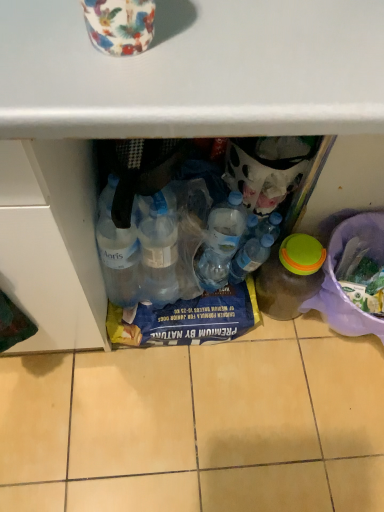
This screenshot has width=384, height=512. Find the location of `transparent plastic bottle at center, the 1th bottle in the left-to-right sequence`. transparent plastic bottle at center, the 1th bottle in the left-to-right sequence is located at coordinates (250, 257).

The width and height of the screenshot is (384, 512). What do you see at coordinates (250, 257) in the screenshot?
I see `transparent plastic bottle at center, the 1th bottle in the left-to-right sequence` at bounding box center [250, 257].

Image resolution: width=384 pixels, height=512 pixels. Describe the element at coordinates (290, 276) in the screenshot. I see `transparent plastic bottle at lower right, marked as the second bottle in a left-to-right arrangement` at that location.

This screenshot has width=384, height=512. I want to click on transparent plastic bottle at lower right, which is the first bottle in right-to-left order, so click(290, 276).

This screenshot has height=512, width=384. What are the coordinates of `transparent plastic bottle at center, the 1th bottle in the left-to-right sequence` in the screenshot? It's located at (250, 257).

Is transparent plastic bottle at lower right, marked as the second bottle in a left-to-right arrangement, to the left of transparent plastic bottle at center, positioned as the second bottle in right-to-left order, from the viewer's perspective?

No, transparent plastic bottle at lower right, marked as the second bottle in a left-to-right arrangement, is not to the left of transparent plastic bottle at center, positioned as the second bottle in right-to-left order.

Which object is further away from the camera taking this photo, transparent plastic bottle at lower right, marked as the second bottle in a left-to-right arrangement, or transparent plastic bottle at center, the 1th bottle in the left-to-right sequence?

transparent plastic bottle at center, the 1th bottle in the left-to-right sequence, is further away from the camera.

Is point (287, 250) positioned in front of point (246, 251)?

That is True.

From the image's perspective, which is above, transparent plastic bottle at lower right, marked as the second bottle in a left-to-right arrangement, or transparent plastic bottle at center, the 1th bottle in the left-to-right sequence?

From the image's view, transparent plastic bottle at center, the 1th bottle in the left-to-right sequence, is above.

From a real-world perspective, is transparent plastic bottle at lower right, marked as the second bottle in a left-to-right arrangement, positioned over transparent plastic bottle at center, the 1th bottle in the left-to-right sequence, based on gravity?

Actually, transparent plastic bottle at lower right, marked as the second bottle in a left-to-right arrangement, is physically below transparent plastic bottle at center, the 1th bottle in the left-to-right sequence, in the real world.

Considering the relative sizes of transparent plastic bottle at lower right, which is the first bottle in right-to-left order, and transparent plastic bottle at center, positioned as the second bottle in right-to-left order, in the image provided, is transparent plastic bottle at lower right, which is the first bottle in right-to-left order, wider than transparent plastic bottle at center, positioned as the second bottle in right-to-left order,?

Correct, the width of transparent plastic bottle at lower right, which is the first bottle in right-to-left order, exceeds that of transparent plastic bottle at center, positioned as the second bottle in right-to-left order.

Who is shorter, transparent plastic bottle at lower right, which is the first bottle in right-to-left order, or transparent plastic bottle at center, the 1th bottle in the left-to-right sequence?

transparent plastic bottle at center, the 1th bottle in the left-to-right sequence.

Looking at the image, does transparent plastic bottle at lower right, marked as the second bottle in a left-to-right arrangement, seem bigger or smaller compared to transparent plastic bottle at center, the 1th bottle in the left-to-right sequence?

In the image, transparent plastic bottle at lower right, marked as the second bottle in a left-to-right arrangement, appears to be larger than transparent plastic bottle at center, the 1th bottle in the left-to-right sequence.

Is transparent plastic bottle at lower right, marked as the second bottle in a left-to-right arrangement, positioned beyond the bounds of transparent plastic bottle at center, the 1th bottle in the left-to-right sequence?

Yes, transparent plastic bottle at lower right, marked as the second bottle in a left-to-right arrangement, is outside of transparent plastic bottle at center, the 1th bottle in the left-to-right sequence.

Is transparent plastic bottle at lower right, marked as the second bottle in a left-to-right arrangement, beside transparent plastic bottle at center, the 1th bottle in the left-to-right sequence?

Yes.

Could you tell me if transparent plastic bottle at lower right, which is the first bottle in right-to-left order, is turned towards transparent plastic bottle at center, positioned as the second bottle in right-to-left order?

No, transparent plastic bottle at lower right, which is the first bottle in right-to-left order, is not aimed at transparent plastic bottle at center, positioned as the second bottle in right-to-left order.

How many degrees apart are the facing directions of transparent plastic bottle at lower right, which is the first bottle in right-to-left order, and transparent plastic bottle at center, the 1th bottle in the left-to-right sequence?

The angular difference between transparent plastic bottle at lower right, which is the first bottle in right-to-left order, and transparent plastic bottle at center, the 1th bottle in the left-to-right sequence, is 1.74 degrees.

I want to click on bottle above the transparent plastic bottle at lower right, which is the first bottle in right-to-left order (from the image's perspective), so click(x=250, y=257).

Based on their positions, is transparent plastic bottle at center, positioned as the second bottle in right-to-left order, located to the left or right of transparent plastic bottle at lower right, marked as the second bottle in a left-to-right arrangement?

Based on their positions, transparent plastic bottle at center, positioned as the second bottle in right-to-left order, is located to the left of transparent plastic bottle at lower right, marked as the second bottle in a left-to-right arrangement.

Considering their positions, is transparent plastic bottle at center, the 1th bottle in the left-to-right sequence, located in front of or behind transparent plastic bottle at lower right, which is the first bottle in right-to-left order?

In the image, transparent plastic bottle at center, the 1th bottle in the left-to-right sequence, appears behind transparent plastic bottle at lower right, which is the first bottle in right-to-left order.

Considering the points (252, 242) and (316, 285), which point is behind, point (252, 242) or point (316, 285)?

The point (316, 285) is farther.

From the image's perspective, is transparent plastic bottle at center, the 1th bottle in the left-to-right sequence, under transparent plastic bottle at lower right, which is the first bottle in right-to-left order?

Incorrect, from the image's perspective, transparent plastic bottle at center, the 1th bottle in the left-to-right sequence, is higher than transparent plastic bottle at lower right, which is the first bottle in right-to-left order.

In the scene shown: From a real-world perspective, who is located lower, transparent plastic bottle at center, positioned as the second bottle in right-to-left order, or transparent plastic bottle at lower right, which is the first bottle in right-to-left order?

transparent plastic bottle at lower right, which is the first bottle in right-to-left order, from a real-world perspective.

Does transparent plastic bottle at center, the 1th bottle in the left-to-right sequence, have a greater width compared to transparent plastic bottle at lower right, which is the first bottle in right-to-left order?

No.

Based on the photo, from their relative heights in the image, would you say transparent plastic bottle at center, positioned as the second bottle in right-to-left order, is taller or shorter than transparent plastic bottle at lower right, which is the first bottle in right-to-left order?

transparent plastic bottle at center, positioned as the second bottle in right-to-left order, is shorter than transparent plastic bottle at lower right, which is the first bottle in right-to-left order.

Who is smaller, transparent plastic bottle at center, positioned as the second bottle in right-to-left order, or transparent plastic bottle at lower right, marked as the second bottle in a left-to-right arrangement?

transparent plastic bottle at center, positioned as the second bottle in right-to-left order, is smaller.

Is transparent plastic bottle at center, the 1th bottle in the left-to-right sequence, located outside transparent plastic bottle at lower right, which is the first bottle in right-to-left order?

Yes.

From the picture: Is transparent plastic bottle at center, the 1th bottle in the left-to-right sequence, placed right next to transparent plastic bottle at lower right, marked as the second bottle in a left-to-right arrangement?

Yes, transparent plastic bottle at center, the 1th bottle in the left-to-right sequence, is touching transparent plastic bottle at lower right, marked as the second bottle in a left-to-right arrangement.

Does transparent plastic bottle at center, the 1th bottle in the left-to-right sequence, turn towards transparent plastic bottle at lower right, marked as the second bottle in a left-to-right arrangement?

No, transparent plastic bottle at center, the 1th bottle in the left-to-right sequence, is not turned towards transparent plastic bottle at lower right, marked as the second bottle in a left-to-right arrangement.

How distant is transparent plastic bottle at center, the 1th bottle in the left-to-right sequence, from transparent plastic bottle at lower right, which is the first bottle in right-to-left order?

A distance of 3.18 inches exists between transparent plastic bottle at center, the 1th bottle in the left-to-right sequence, and transparent plastic bottle at lower right, which is the first bottle in right-to-left order.

At what (x,y) coordinates should I click in order to perform the action: click on bottle that is on the right side of transparent plastic bottle at center, the 1th bottle in the left-to-right sequence. Please return your answer as a coordinate pair (x, y). The image size is (384, 512). Looking at the image, I should click on (290, 276).

At what (x,y) coordinates should I click in order to perform the action: click on bottle that is under the transparent plastic bottle at center, the 1th bottle in the left-to-right sequence (from a real-world perspective). Please return your answer as a coordinate pair (x, y). Looking at the image, I should click on (290, 276).

Image resolution: width=384 pixels, height=512 pixels. In order to click on bottle that is on the right side of transparent plastic bottle at center, the 1th bottle in the left-to-right sequence in this screenshot , I will do `click(290, 276)`.